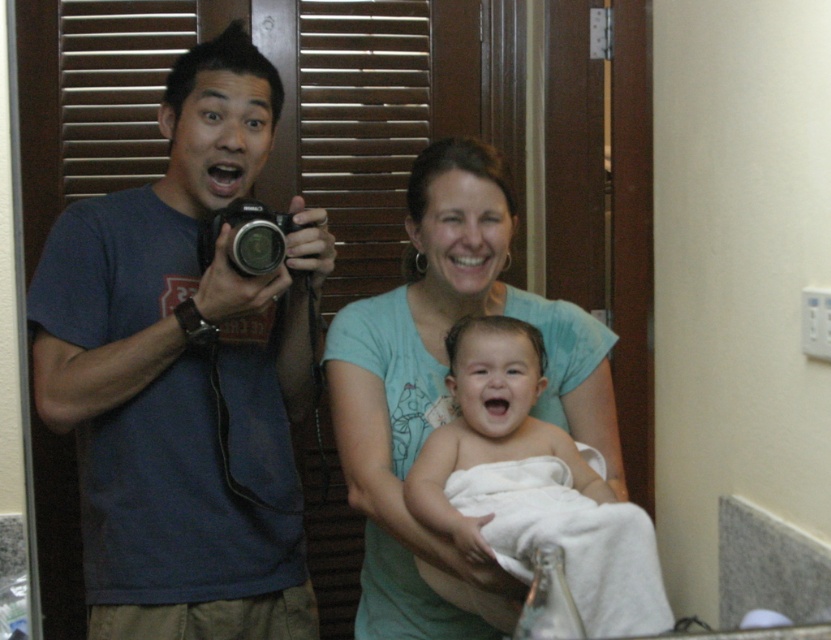
Is blue cotton t-shirt at left wider than black plastic camera at left?

Yes, blue cotton t-shirt at left is wider than black plastic camera at left.

The width and height of the screenshot is (831, 640). Describe the element at coordinates (185, 374) in the screenshot. I see `blue cotton t-shirt at left` at that location.

Where is `blue cotton t-shirt at left`? blue cotton t-shirt at left is located at coordinates (185, 374).

Describe the element at coordinates (185, 374) in the screenshot. I see `blue cotton t-shirt at left` at that location.

Between blue cotton t-shirt at left and light blue t-shirt at center, which one appears on the right side from the viewer's perspective?

Positioned to the right is light blue t-shirt at center.

Between point (308, 212) and point (366, 484), which one is positioned behind?

The point (308, 212) is more distant.

Where is `blue cotton t-shirt at left`? blue cotton t-shirt at left is located at coordinates point(185,374).

Is white soft towel at center bigger than black plastic camera at left?

Correct, white soft towel at center is larger in size than black plastic camera at left.

Does white soft towel at center have a greater width compared to black plastic camera at left?

Correct, the width of white soft towel at center exceeds that of black plastic camera at left.

Who is more distant from viewer, (576, 540) or (244, 272)?

Positioned behind is point (244, 272).

Locate an element on the screen. This screenshot has height=640, width=831. white soft towel at center is located at coordinates (530, 483).